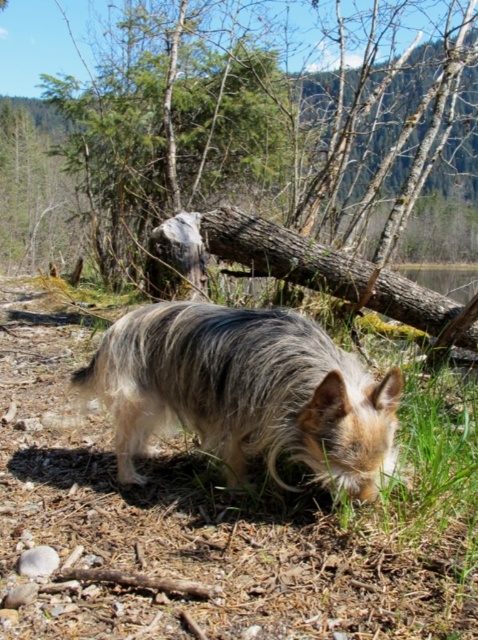
You are standing at the origin point in the image and want to find the green mossy log at center. Which direction should you move to reach it?

The green mossy log at center is located at point 0.194 in the x coordinate and 0.510 in the y coordinate. Since the origin is at the bottom left corner of the image, you should move to the right and slightly upwards to reach it.

You are a hiker who wants to cross over the green mossy log at center. However, there is a fuzzy fur dog at center in the way. Can you step over the dog to reach the log?

The green mossy log at center is located above the fuzzy fur dog at center, so the dog is already beneath the log. Therefore, you can safely step over the dog to reach the log since the log is positioned above the dog.